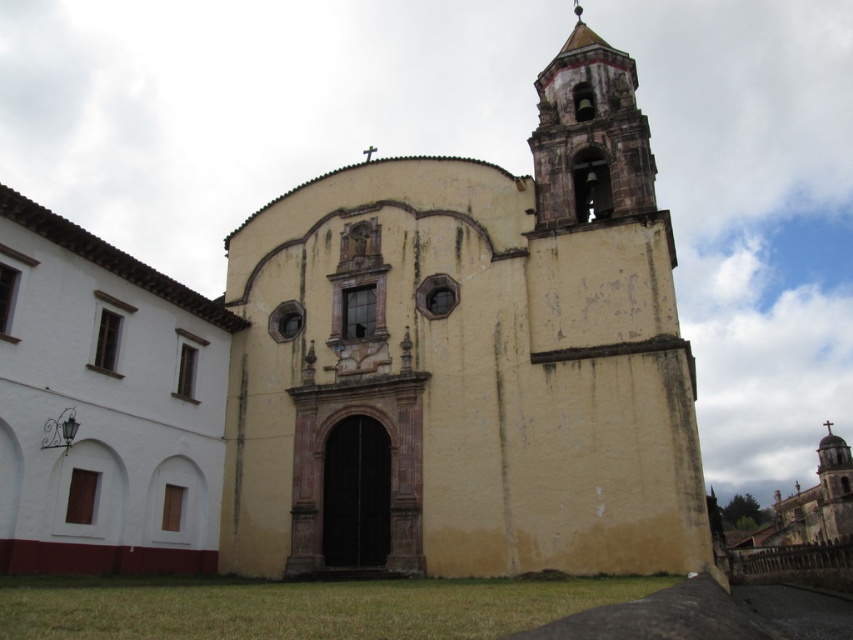
You are an architect designing a new plaza in front of the yellow matte church at center and the white matte building at left. Which building should you prioritize in terms of space allocation considering their sizes?

The yellow matte church at center has a larger width than the white matte building at left, so you should prioritize allocating more space to the yellow matte church at center.

You are a tourist standing in front of the yellow matte church at center and the white matte building at left. You want to take a photo that includes both buildings. Which building should you position closer to the camera to ensure both are fully visible in the frame?

You should position the white matte building at left closer to the camera because the yellow matte church at center is larger in size. This way, both buildings will fit within the camera frame without one being cut off.

You are standing in front of the yellow matte church at center and want to see the white matte building at left. Can you see it clearly without moving your position?

The white matte building at left is behind the yellow matte church at center, so you cannot see it clearly from your current position without moving.